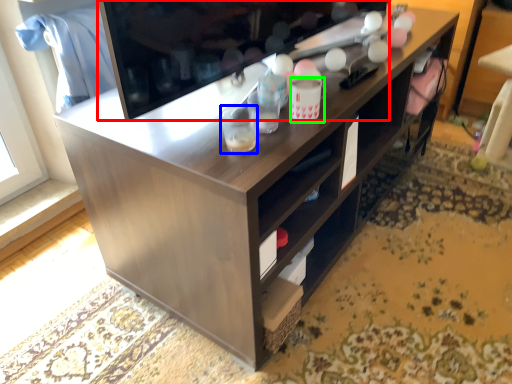
Question: Estimate the real-world distances between objects in this image. Which object is closer to television (highlighted by a red box), beverage (highlighted by a blue box) or beverage (highlighted by a green box)?

Choices:
 (A) beverage
 (B) beverage

Answer: (A)